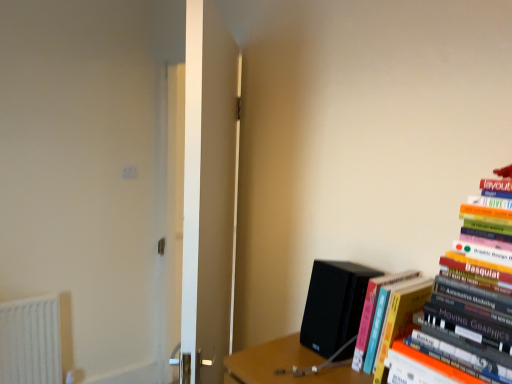
Question: From the image's perspective, does orange matte book at right, which appears as the first book when viewed from the back, appear lower than black matte speaker at lower right?

Choices:
 (A) yes
 (B) no

Answer: (A)

Question: Is orange matte book at right, which appears as the first book when viewed from the back, positioned before black matte speaker at lower right?

Choices:
 (A) yes
 (B) no

Answer: (A)

Question: Is orange matte book at right, which appears as the first book when viewed from the back, bigger than black matte speaker at lower right?

Choices:
 (A) yes
 (B) no

Answer: (B)

Question: Can you confirm if orange matte book at right, which appears as the first book when viewed from the back, is thinner than black matte speaker at lower right?

Choices:
 (A) no
 (B) yes

Answer: (A)

Question: Could you tell me if orange matte book at right, which is the second book from front to back, is turned towards black matte speaker at lower right?

Choices:
 (A) no
 (B) yes

Answer: (A)

Question: From the image's perspective, is black matte speaker at lower right above or below orange matte book at right, which appears as the first book when viewed from the back?

Choices:
 (A) below
 (B) above

Answer: (B)

Question: In terms of width, does black matte speaker at lower right look wider or thinner when compared to orange matte book at right, which is the second book from front to back?

Choices:
 (A) wide
 (B) thin

Answer: (B)

Question: From a real-world perspective, is black matte speaker at lower right physically located above or below orange matte book at right, which is the second book from front to back?

Choices:
 (A) below
 (B) above

Answer: (B)

Question: Is black matte speaker at lower right to the left or to the right of orange matte book at right, which is the second book from front to back, in the image?

Choices:
 (A) left
 (B) right

Answer: (A)

Question: Does point (342, 354) appear closer or farther from the camera than point (475, 294)?

Choices:
 (A) closer
 (B) farther

Answer: (B)

Question: From the image's perspective, relative to hardcover books at right, positioned as the second book in back-to-front order, is black matte speaker at lower right above or below?

Choices:
 (A) below
 (B) above

Answer: (A)

Question: Would you say black matte speaker at lower right is to the left or to the right of hardcover books at right, placed as the first book when sorted from front to back, in the picture?

Choices:
 (A) left
 (B) right

Answer: (A)

Question: Which is correct: black matte speaker at lower right is inside hardcover books at right, placed as the first book when sorted from front to back, or outside of it?

Choices:
 (A) outside
 (B) inside

Answer: (A)

Question: Considering their positions, is hardcover books at right, placed as the first book when sorted from front to back, located in front of or behind black matte speaker at lower right?

Choices:
 (A) front
 (B) behind

Answer: (A)

Question: Is point (477, 205) closer or farther from the camera than point (335, 314)?

Choices:
 (A) closer
 (B) farther

Answer: (A)